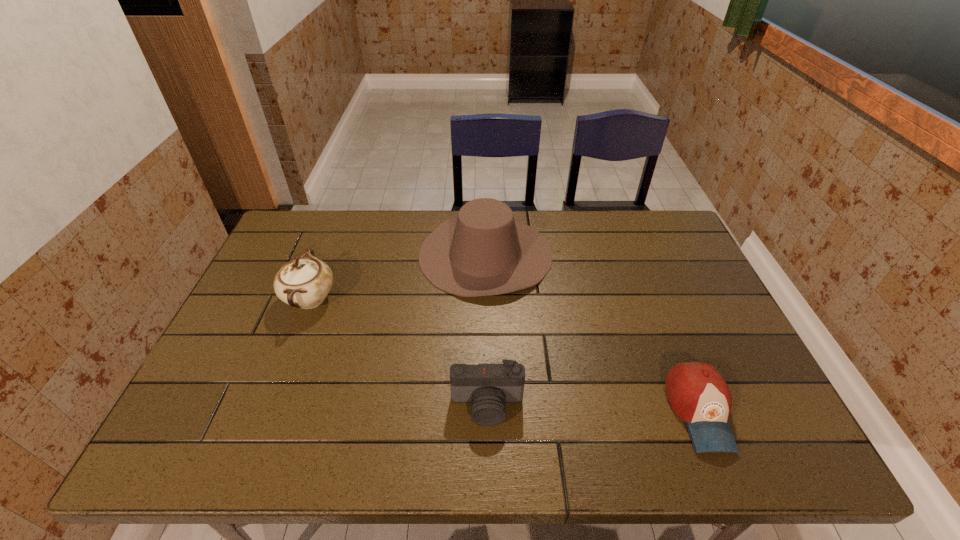
Find the location of a particular element. The image size is (960, 540). object that stands as the third closest to the chinaware is located at coordinates (698, 394).

Identify which object is the second closest to the leftmost object. Please provide its 2D coordinates. Your answer should be formatted as a tuple, i.e. [(x, y)], where the tuple contains the x and y coordinates of a point satisfying the conditions above.

[(488, 387)]